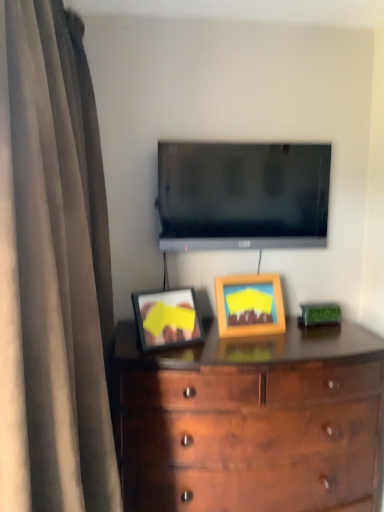
Question: Visually, is brown fabric curtain at left positioned to the left or to the right of wooden picture frame at center?

Choices:
 (A) right
 (B) left

Answer: (B)

Question: Looking at their shapes, would you say brown fabric curtain at left is wider or thinner than wooden picture frame at center?

Choices:
 (A) thin
 (B) wide

Answer: (B)

Question: Estimate the real-world distances between objects in this image. Which object is farther from the wooden chest of drawers at center?

Choices:
 (A) wooden picture frame at center
 (B) brown fabric curtain at left
 (C) flat screen tv at upper center

Answer: (B)

Question: Considering the real-world distances, which object is farthest from the wooden chest of drawers at center?

Choices:
 (A) brown fabric curtain at left
 (B) flat screen tv at upper center
 (C) wooden picture frame at center

Answer: (A)